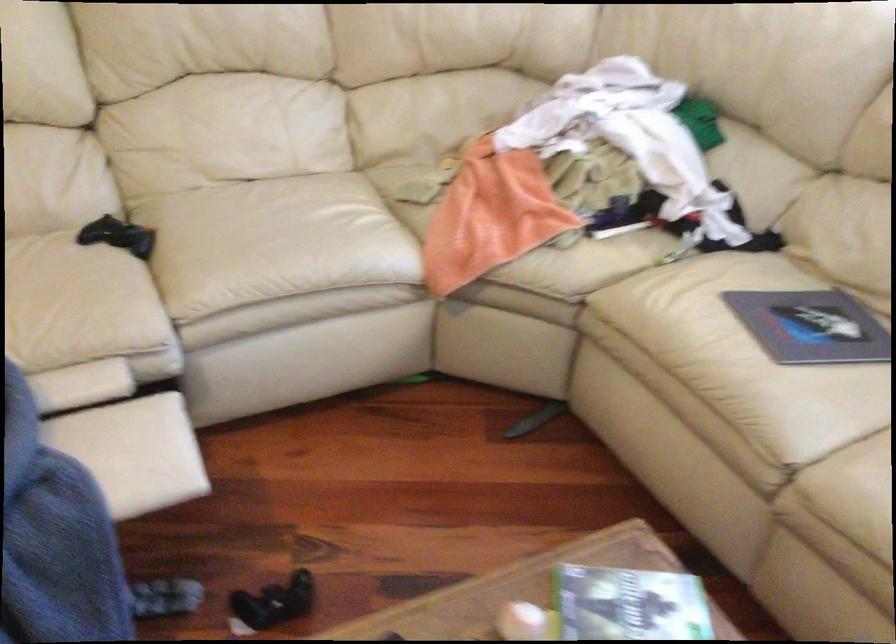
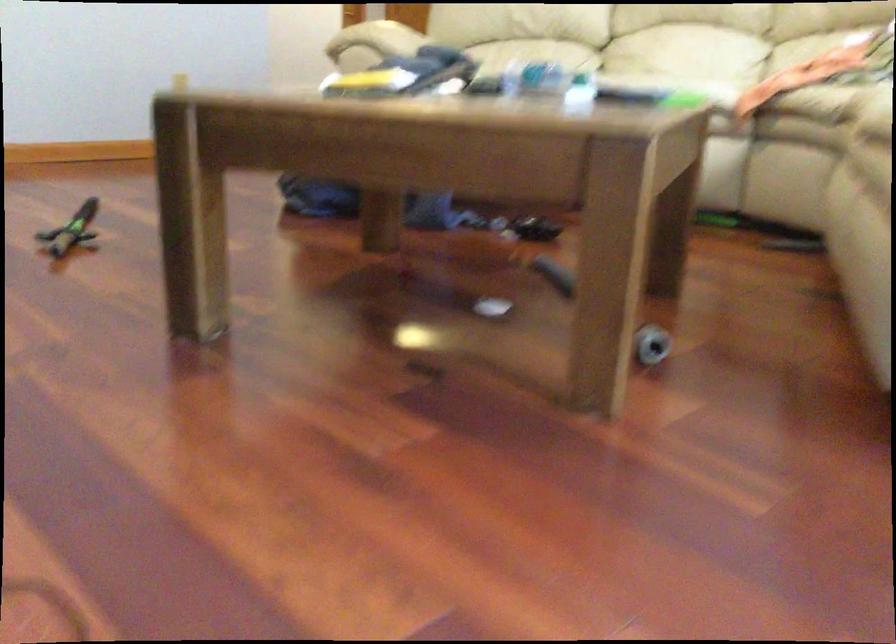
The point at (247,136) is marked in the first image. Where is the corresponding point in the second image?

(686, 59)